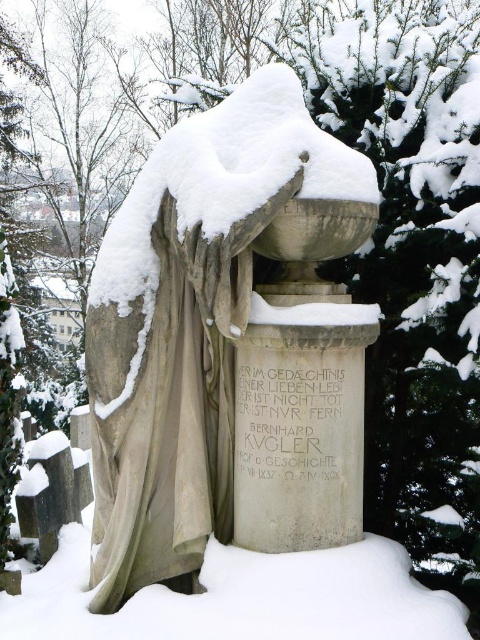
Who is shorter, stone statue at center or white stone inscription at center?

white stone inscription at center

Identify the location of stone statue at center. (228, 344).